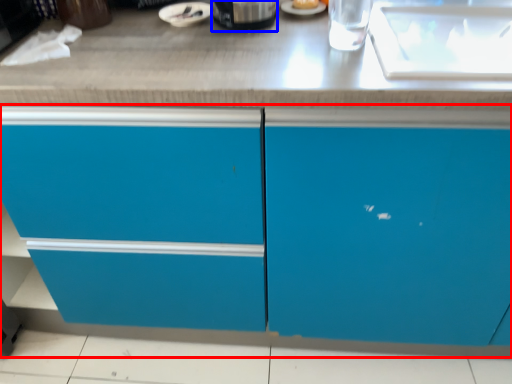
Question: Which point is closer to the camera, cabinetry (highlighted by a red box) or appliance (highlighted by a blue box)?

Choices:
 (A) cabinetry
 (B) appliance

Answer: (A)